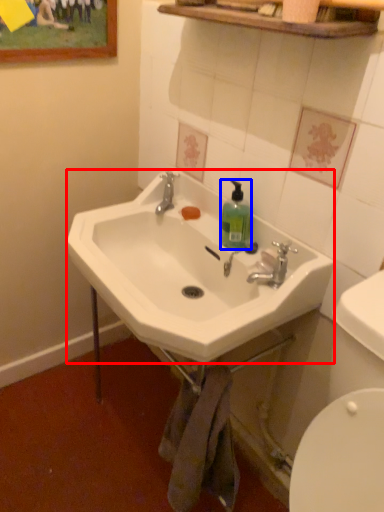
Question: Which object appears farthest to the camera in this image, sink (highlighted by a red box) or bottle (highlighted by a blue box)?

Choices:
 (A) sink
 (B) bottle

Answer: (B)